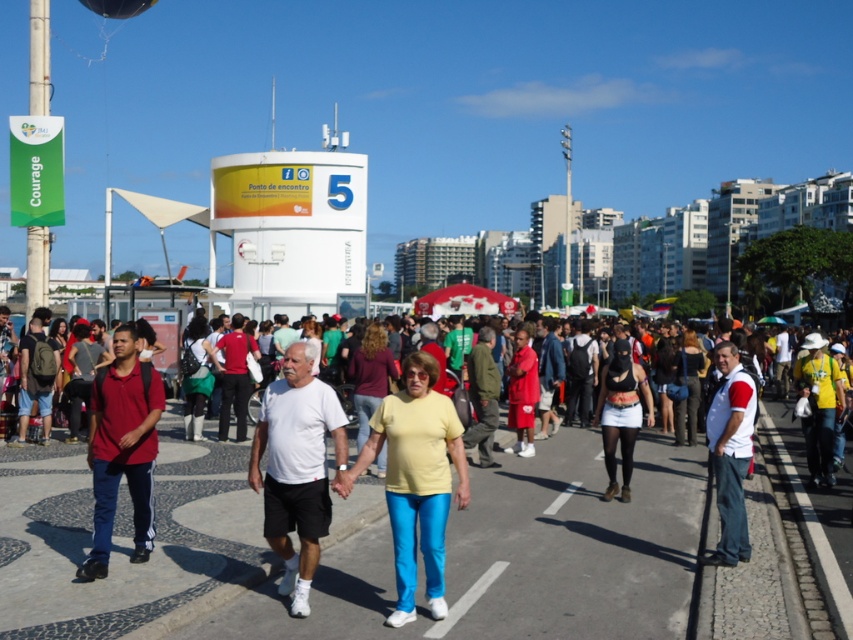
Question: Which point is farther to the camera?

Choices:
 (A) yellow matte shirt at center
 (B) red fabric shirt at center

Answer: (B)

Question: Can you confirm if white matte shirt at center is smaller than transparent plastic balloon at upper left?

Choices:
 (A) yes
 (B) no

Answer: (A)

Question: Among these objects, which one is nearest to the camera?

Choices:
 (A) white matte shirt at center
 (B) white/red short-sleeved shirt at center-right

Answer: (A)

Question: Is red fabric shirt at center to the left of transparent plastic balloon at upper left from the viewer's perspective?

Choices:
 (A) yes
 (B) no

Answer: (B)

Question: Can you confirm if white matte shirt at center is bigger than matte red shirt at left?

Choices:
 (A) yes
 (B) no

Answer: (A)

Question: Among these points, which one is farthest from the camera?

Choices:
 (A) (602, 492)
 (B) (138, 493)
 (C) (270, 436)

Answer: (A)